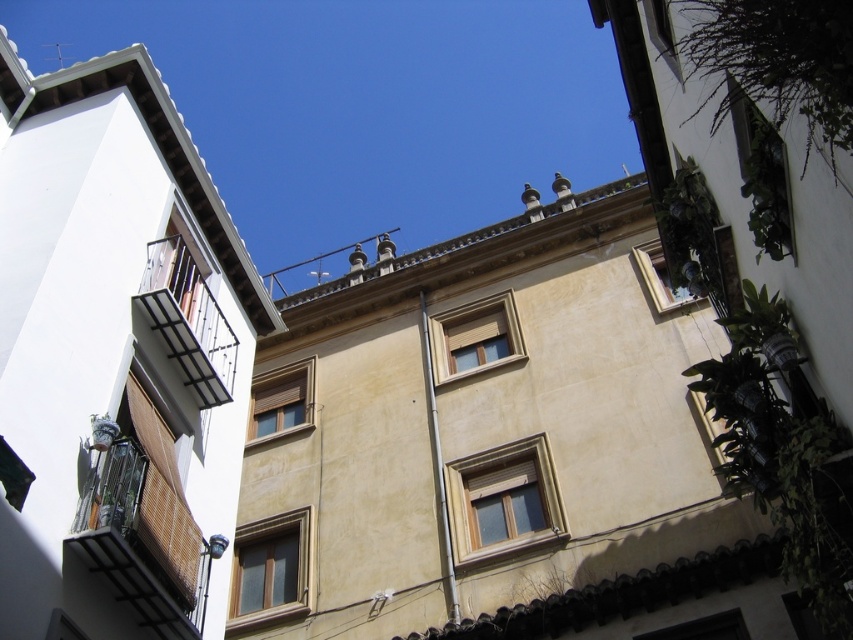
Is rustic wood balcony at lower left below black wrought iron balcony at left?

Yes, rustic wood balcony at lower left is below black wrought iron balcony at left.

Between point (114, 499) and point (148, 276), which one is positioned in front?

Point (114, 499) is in front.

The width and height of the screenshot is (853, 640). Identify the location of rustic wood balcony at lower left. (141, 544).

Between green matte window at upper right and wooden at center, which one appears on the right side from the viewer's perspective?

green matte window at upper right

At what (x,y) coordinates should I click in order to perform the action: click on green matte window at upper right. Please return your answer as a coordinate pair (x, y). Looking at the image, I should click on (761, 176).

Does wooden at center appear under wooden blinds at center?

Actually, wooden at center is above wooden blinds at center.

Does point (451, 337) lie in front of point (299, 385)?

Yes, it is in front of point (299, 385).

Image resolution: width=853 pixels, height=640 pixels. Find the location of `wooden at center`. wooden at center is located at coordinates (474, 337).

Where is `wooden at center`? The height and width of the screenshot is (640, 853). wooden at center is located at coordinates (474, 337).